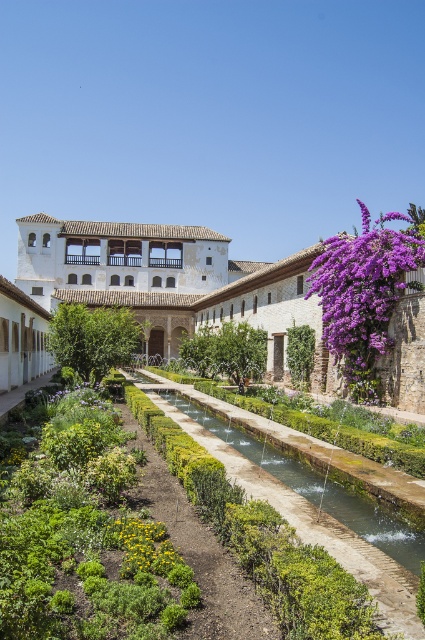
You are a gardener in the historical garden and need to place a new statue between the purple matte flowers at upper right and the yellow matte flower at center. Based on their positions, which flower should be placed closer to the building to ensure the statue is centered between them?

The purple matte flowers at upper right is to the right of yellow matte flower at center, so to center the statue between them, the yellow matte flower at center should be placed closer to the building since it is positioned to the left of the purple matte flowers at upper right.

You are a gardener who needs to water both the green mossy stone path at center and the yellow matte flower at center. Since you can only carry enough water for one object at a time, you want to know which one is closer to your current position at the garden entrance. Can you determine which one is nearer?

The green mossy stone path at center and yellow matte flower at center are 4.21 meters apart from each other. Since the distance between them is fixed, the proximity to your current position depends on their exact locations relative to the entrance. However, without additional information about their positions along the path or the layout of the garden, it is impossible to determine which is closer. Please provide more details about their specific locations or the garden layout.

You are standing in the garden and want to walk to the green leafy plant at center. Which direction should you move relative to the green mossy stone path at center?

You should move away from the green mossy stone path at center towards the green leafy plant at center since the green mossy stone path is closer to you.